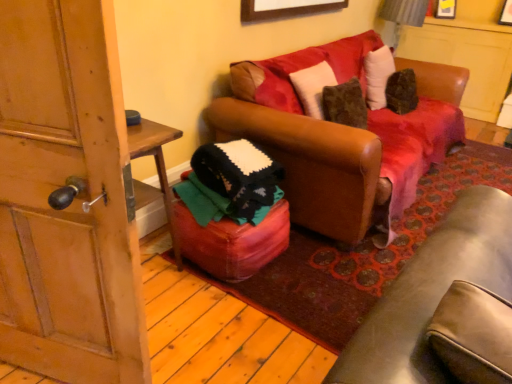
Question: From a real-world perspective, is wooden door at left positioned above or below wooden picture frame at upper center?

Choices:
 (A) above
 (B) below

Answer: (B)

Question: Is wooden door at left to the left or to the right of wooden picture frame at upper center in the image?

Choices:
 (A) right
 (B) left

Answer: (B)

Question: Which object is the farthest from the wooden door at left?

Choices:
 (A) brown leather couch at center
 (B) wooden picture frame at upper center
 (C) leather ottoman at center

Answer: (B)

Question: Which is farther from the leather ottoman at center?

Choices:
 (A) wooden door at left
 (B) wooden picture frame at upper center
 (C) brown leather couch at center

Answer: (B)